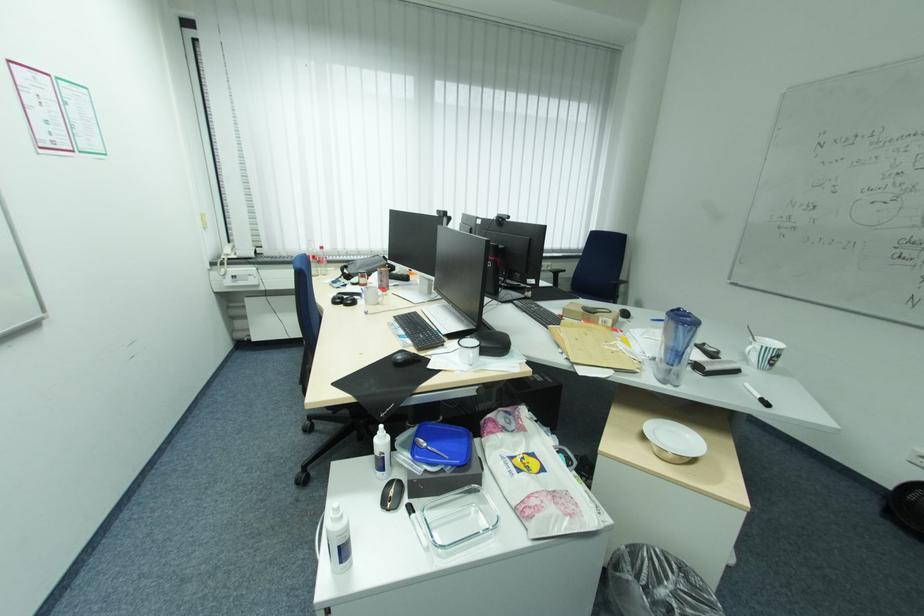
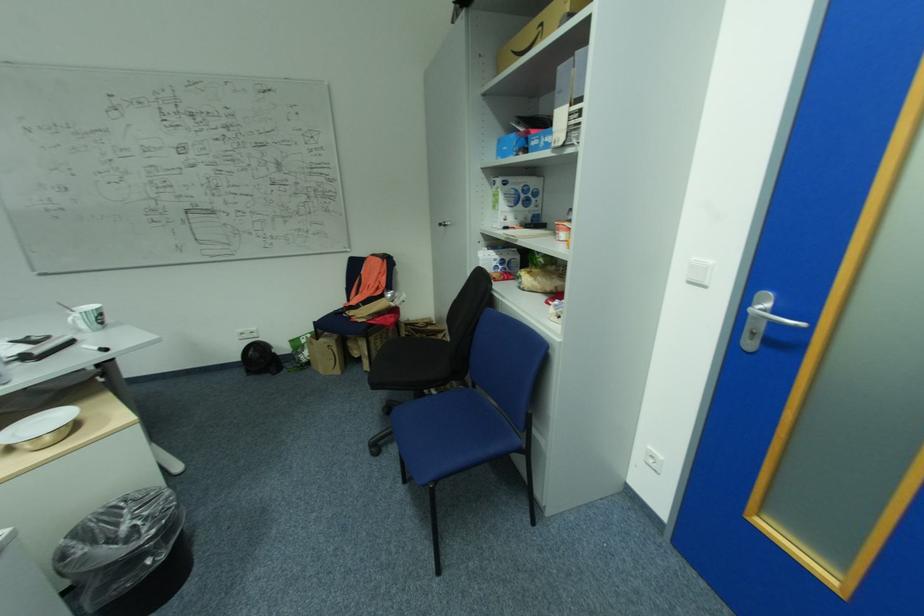
Based on the continuous images, in which direction is the camera rotating?

The camera's rotation is toward right-down.